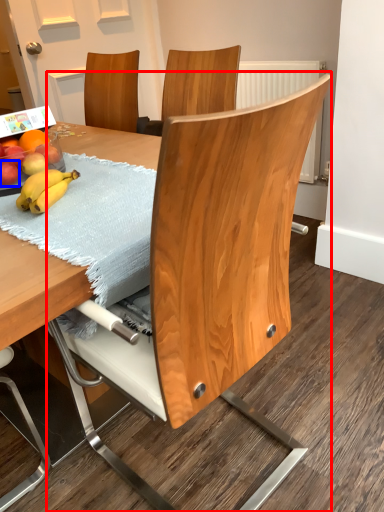
Question: Which object appears closest to the camera in this image, chair (highlighted by a red box) or apple (highlighted by a blue box)?

Choices:
 (A) chair
 (B) apple

Answer: (A)